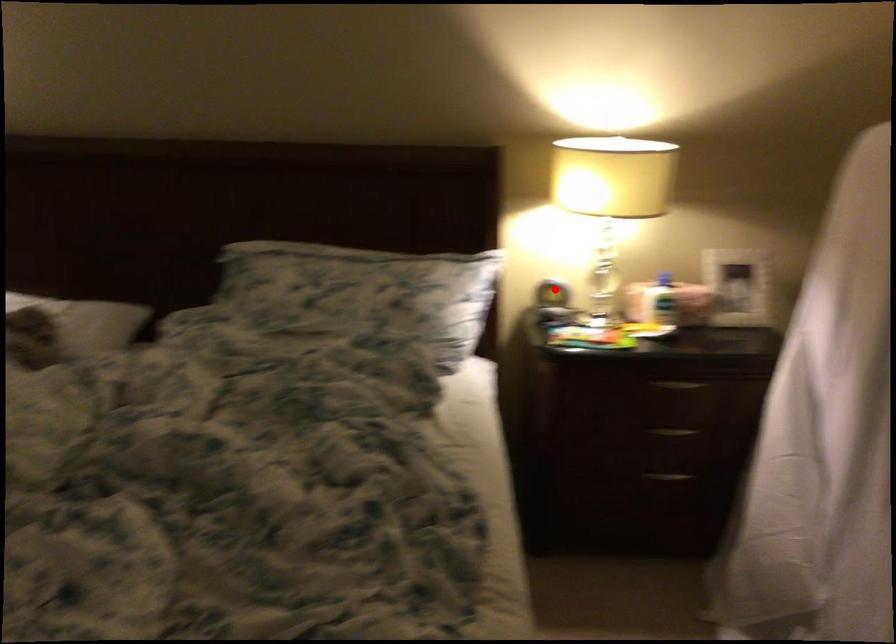
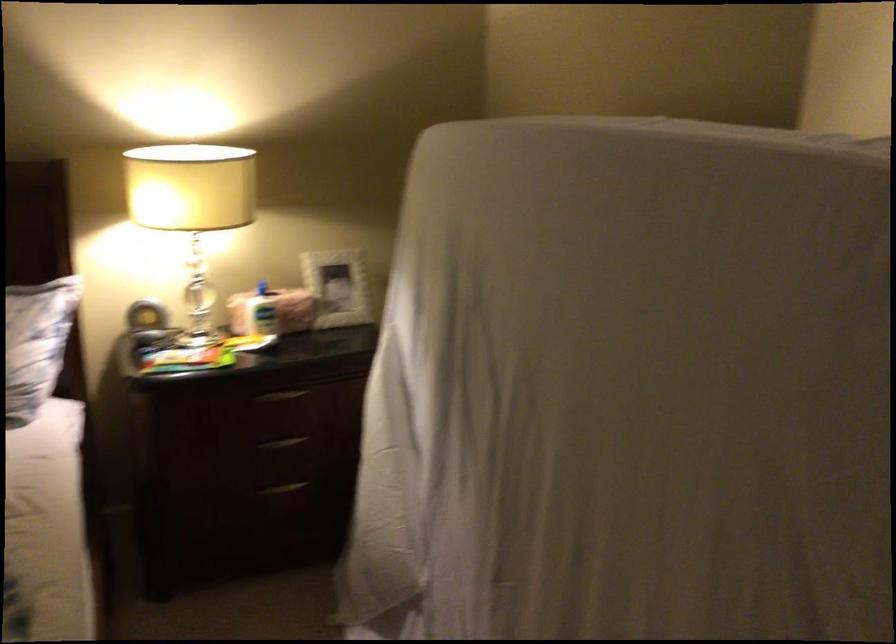
In the second image, find the point that corresponds to the highlighted location in the first image.

(145, 316)